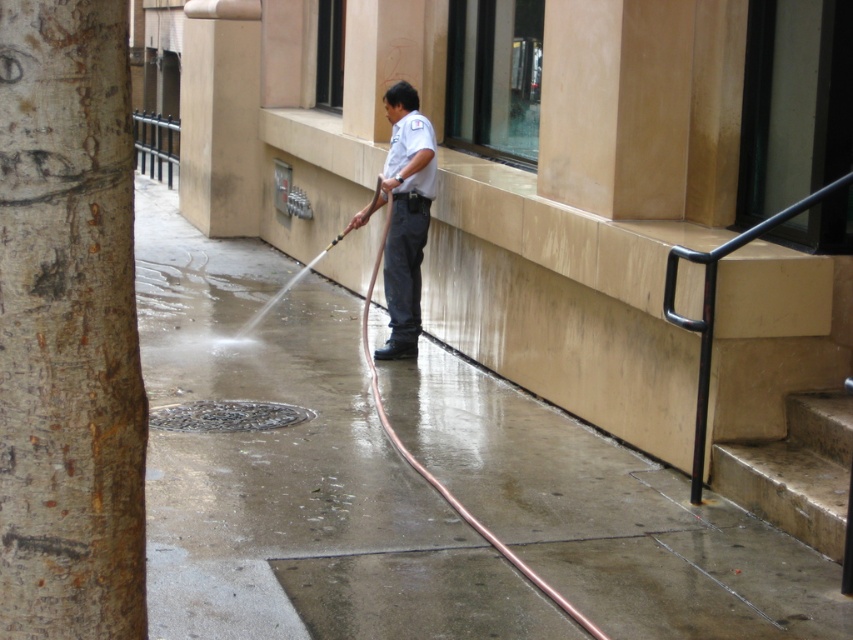
Question: Does smooth bark tree trunk at left appear on the left side of concrete stairs at lower right?

Choices:
 (A) yes
 (B) no

Answer: (A)

Question: Is concrete stairs at lower right smaller than white uniform at center?

Choices:
 (A) no
 (B) yes

Answer: (B)

Question: Which point is farther to the camera?

Choices:
 (A) smooth bark tree trunk at left
 (B) white uniform at center

Answer: (B)

Question: Is glossy concrete sidewalk at center positioned at the back of white uniform at center?

Choices:
 (A) no
 (B) yes

Answer: (A)

Question: Estimate the real-world distances between objects in this image. Which object is closer to the glossy concrete sidewalk at center?

Choices:
 (A) white uniform at center
 (B) concrete stairs at lower right
 (C) smooth bark tree trunk at left

Answer: (A)

Question: Among these objects, which one is nearest to the camera?

Choices:
 (A) white uniform at center
 (B) smooth bark tree trunk at left
 (C) glossy concrete sidewalk at center

Answer: (B)